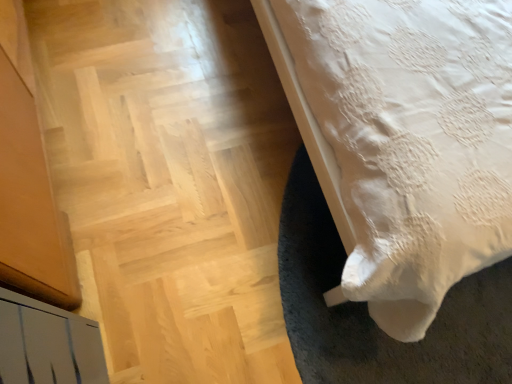
Question: Is white lace bed at lower right at the right side of wooden parquet floor at lower left?

Choices:
 (A) no
 (B) yes

Answer: (B)

Question: Considering the relative sizes of white lace bed at lower right and wooden parquet floor at lower left in the image provided, is white lace bed at lower right shorter than wooden parquet floor at lower left?

Choices:
 (A) no
 (B) yes

Answer: (A)

Question: Is white lace bed at lower right directly adjacent to wooden parquet floor at lower left?

Choices:
 (A) yes
 (B) no

Answer: (B)

Question: From a real-world perspective, does white lace bed at lower right sit lower than wooden parquet floor at lower left?

Choices:
 (A) no
 (B) yes

Answer: (A)

Question: Does white lace bed at lower right have a smaller size compared to wooden parquet floor at lower left?

Choices:
 (A) no
 (B) yes

Answer: (A)

Question: Considering the relative positions of white lace bed at lower right and wooden parquet floor at lower left in the image provided, is white lace bed at lower right in front of wooden parquet floor at lower left?

Choices:
 (A) yes
 (B) no

Answer: (A)

Question: Is wooden parquet floor at lower left far from white lace bed at lower right?

Choices:
 (A) no
 (B) yes

Answer: (A)

Question: Does wooden parquet floor at lower left appear on the left side of white lace bed at lower right?

Choices:
 (A) yes
 (B) no

Answer: (A)

Question: Does wooden parquet floor at lower left touch white lace bed at lower right?

Choices:
 (A) yes
 (B) no

Answer: (B)

Question: From a real-world perspective, is wooden parquet floor at lower left below white lace bed at lower right?

Choices:
 (A) yes
 (B) no

Answer: (A)

Question: Can white lace bed at lower right be found inside wooden parquet floor at lower left?

Choices:
 (A) yes
 (B) no

Answer: (B)

Question: From a real-world perspective, is wooden parquet floor at lower left located higher than white lace bed at lower right?

Choices:
 (A) no
 (B) yes

Answer: (A)

Question: Would you say white lace bed at lower right is to the left or to the right of wooden parquet floor at lower left in the picture?

Choices:
 (A) left
 (B) right

Answer: (B)